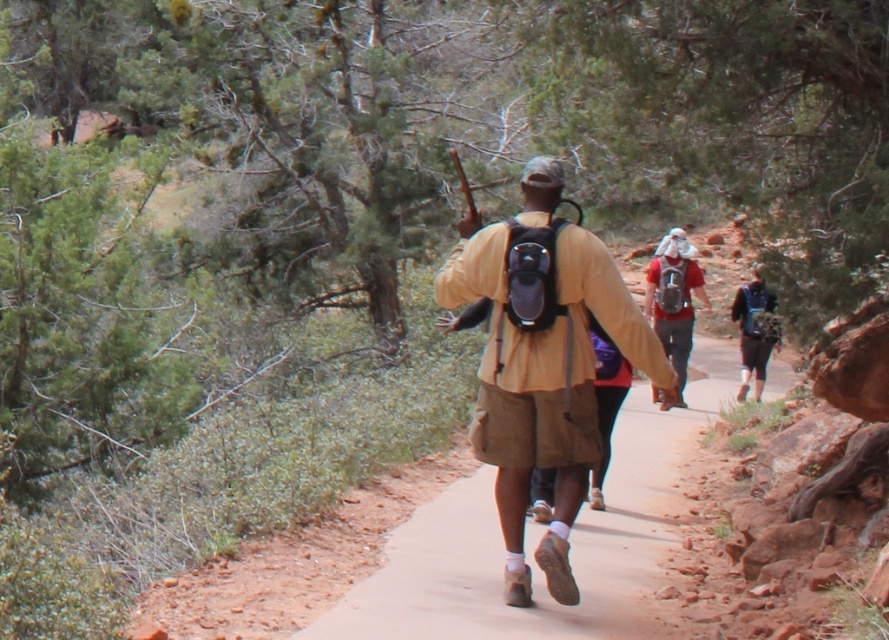
You are a hiker planning to carry both the matte blue backpack at center and the matte black backpack at center on your next trip. Since you want to ensure that your backpack straps are long enough to accommodate the taller one, which backpack requires straps that can handle more height?

The matte blue backpack at center requires straps that can handle more height because it is much taller than the matte black backpack at center.

You are a photographer standing at the camera position. You want to take a photo of the red fabric backpack at center. The camera has a maximum focus range of 20 meters. Will the backpack be in focus?

The red fabric backpack at center is 20.12 meters from the camera. Since the maximum focus range is 20 meters, the backpack is slightly out of the focus range and will not be in focus.

You are a hiker planning to place a small first aid kit on the ground near the point marked at coordinates (542, 362). Based on the scene, what object is located at that point?

The point at coordinates (542, 362) has the matte khaki shirt at center placed there.